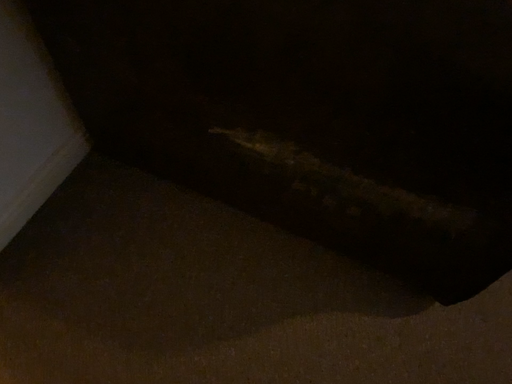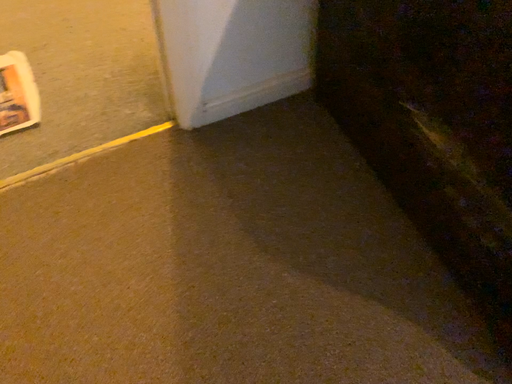
Question: Which way did the camera rotate in the video?

Choices:
 (A) rotated upward
 (B) rotated downward

Answer: (A)